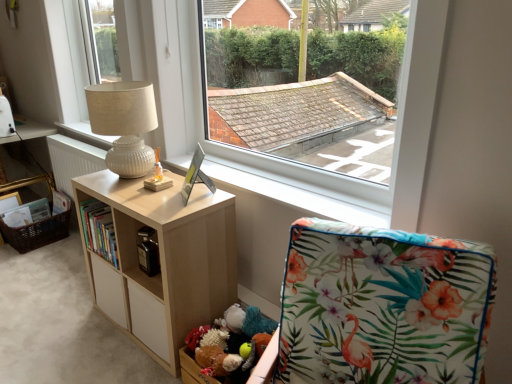
Question: Considering the relative positions of brown woven basket at lower left and white glossy radiator at left in the image provided, is brown woven basket at lower left to the left or to the right of white glossy radiator at left?

Choices:
 (A) left
 (B) right

Answer: (A)

Question: Which is correct: brown woven basket at lower left is inside white glossy radiator at left, or outside of it?

Choices:
 (A) inside
 (B) outside

Answer: (B)

Question: Considering the real-world distances, which object is closest to the transparent glass window at upper center, the 2th window from the left?

Choices:
 (A) beige fabric lampshade at upper left, the second window from the right
 (B) brown woven basket at lower left
 (C) white glossy radiator at left
 (D) hardcover book at center
 (E) white textured lamp at upper left

Answer: (E)

Question: Which of these objects is positioned closest to the white textured lamp at upper left?

Choices:
 (A) white glossy radiator at left
 (B) beige fabric lampshade at upper left, the 1th window from the back
 (C) white wooden window sill at center
 (D) brown woven basket at lower left
 (E) hardcover book at center

Answer: (E)